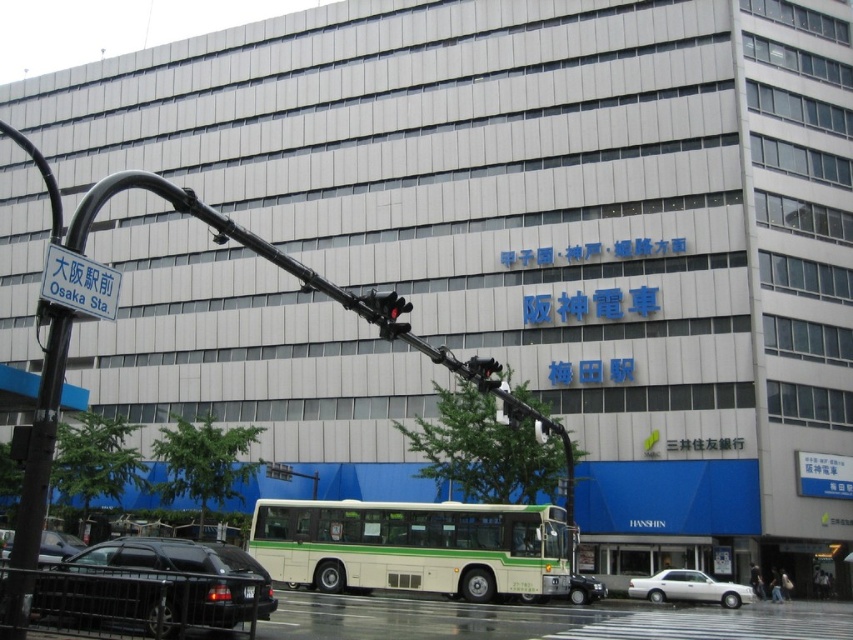
You are standing at the bus stop in front of the Hanshin Railway building. You notice two points marked on the building facade. One is at coordinate point (653,596) and the other at point (374,321). Which point is closer to you?

Point (653,596) is closer to you because it is further to the viewer than point (374,321).